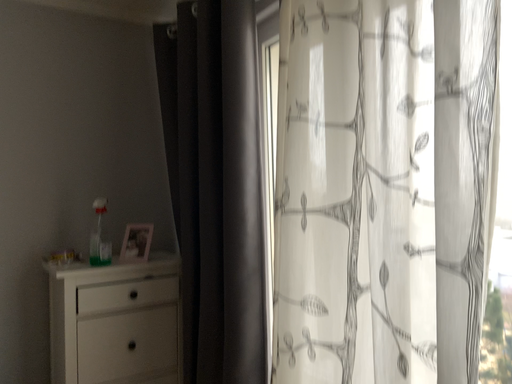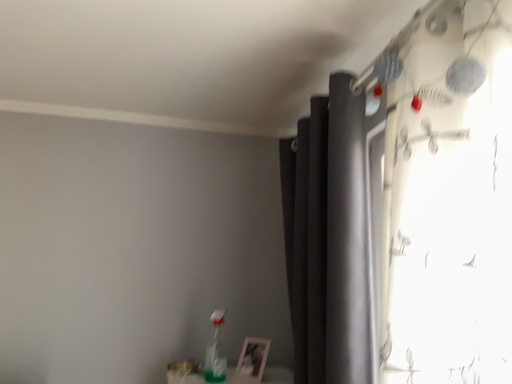
Question: How did the camera likely rotate when shooting the video?

Choices:
 (A) rotated right
 (B) rotated left

Answer: (B)